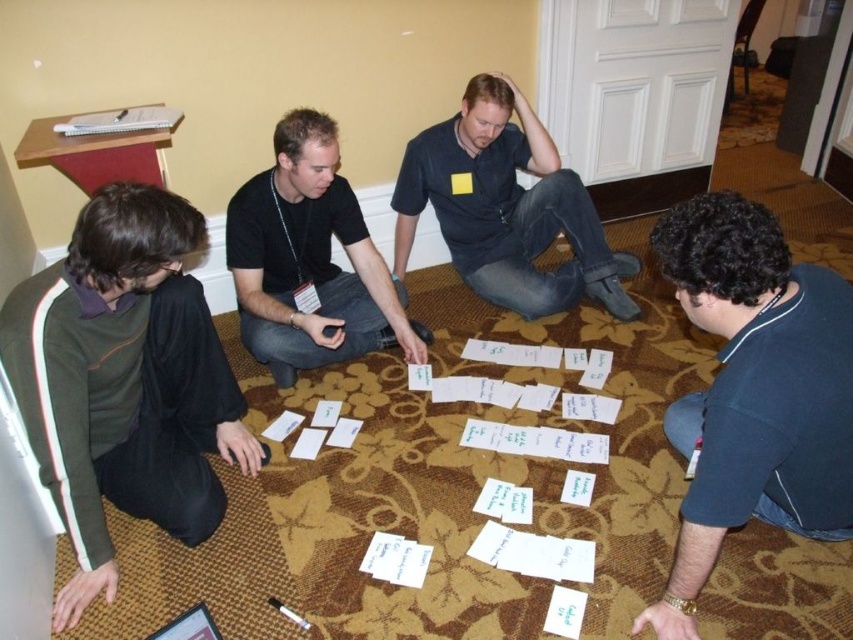
You are a delivery robot with a 1.2 meter wide package. You need to move between the green fabric shirt at lower left and the dark blue shirt at lower right. Can you fit through the space between them?

The distance between the green fabric shirt at lower left and the dark blue shirt at lower right is 1.17 meters. Since the package is 1.2 meters wide, it is slightly wider than the available space. Therefore, the robot cannot fit through the space between them.

You are organizing a card game and need to place a new rule card on the table. The rule card is 20 cm wide. Can the white paper at center accommodate it without overlapping the black cotton shirt at center?

The white paper at center is larger in width than the black cotton shirt at center. Since the rule card is 20 cm wide, it can be placed on the white paper at center without overlapping the black cotton shirt at center provided there is sufficient space along the width.